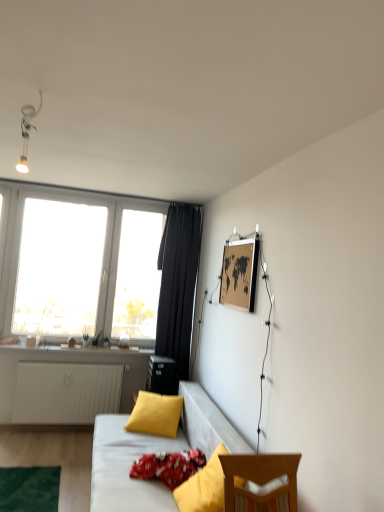
Question: Can you confirm if yellow fabric pillow at lower right, marked as the first pillow in a front-to-back arrangement, is taller than yellow matte pillow at center, which appears as the first pillow when viewed from the back?

Choices:
 (A) no
 (B) yes

Answer: (B)

Question: Is yellow fabric pillow at lower right, marked as the first pillow in a front-to-back arrangement, to the left of yellow matte pillow at center, which appears as the first pillow when viewed from the back, from the viewer's perspective?

Choices:
 (A) yes
 (B) no

Answer: (B)

Question: From a real-world perspective, is yellow fabric pillow at lower right, which is the 3th pillow in back-to-front order, physically below yellow matte pillow at center, which appears as the first pillow when viewed from the back?

Choices:
 (A) yes
 (B) no

Answer: (B)

Question: From the image's perspective, is yellow fabric pillow at lower right, marked as the first pillow in a front-to-back arrangement, below yellow matte pillow at center, the 3th pillow positioned from the front?

Choices:
 (A) no
 (B) yes

Answer: (A)

Question: Can you confirm if yellow fabric pillow at lower right, which is the 3th pillow in back-to-front order, is positioned to the right of yellow matte pillow at center, which appears as the first pillow when viewed from the back?

Choices:
 (A) yes
 (B) no

Answer: (A)

Question: From the image's perspective, is wooden map at upper right positioned above or below yellow fabric pillow at lower right, which is the 3th pillow in back-to-front order?

Choices:
 (A) above
 (B) below

Answer: (A)

Question: From their relative heights in the image, would you say wooden map at upper right is taller or shorter than yellow fabric pillow at lower right, marked as the first pillow in a front-to-back arrangement?

Choices:
 (A) tall
 (B) short

Answer: (B)

Question: Which is correct: wooden map at upper right is inside yellow fabric pillow at lower right, which is the 3th pillow in back-to-front order, or outside of it?

Choices:
 (A) inside
 (B) outside

Answer: (B)

Question: From a real-world perspective, is wooden map at upper right above or below yellow fabric pillow at lower right, which is the 3th pillow in back-to-front order?

Choices:
 (A) below
 (B) above

Answer: (B)

Question: Considering the positions of point (172, 280) and point (182, 476), is point (172, 280) closer or farther from the camera than point (182, 476)?

Choices:
 (A) closer
 (B) farther

Answer: (B)

Question: Is black fabric curtain at center in front of or behind red cotton pillow at lower center, marked as the second pillow in a front-to-back arrangement, in the image?

Choices:
 (A) front
 (B) behind

Answer: (B)

Question: In terms of height, does black fabric curtain at center look taller or shorter compared to red cotton pillow at lower center, arranged as the second pillow when viewed from the back?

Choices:
 (A) tall
 (B) short

Answer: (A)

Question: In terms of width, does black fabric curtain at center look wider or thinner when compared to red cotton pillow at lower center, arranged as the second pillow when viewed from the back?

Choices:
 (A) thin
 (B) wide

Answer: (A)

Question: Looking at their shapes, would you say red cotton pillow at lower center, marked as the second pillow in a front-to-back arrangement, is wider or thinner than wooden map at upper right?

Choices:
 (A) wide
 (B) thin

Answer: (A)

Question: Do you think red cotton pillow at lower center, marked as the second pillow in a front-to-back arrangement, is within wooden map at upper right, or outside of it?

Choices:
 (A) inside
 (B) outside

Answer: (B)